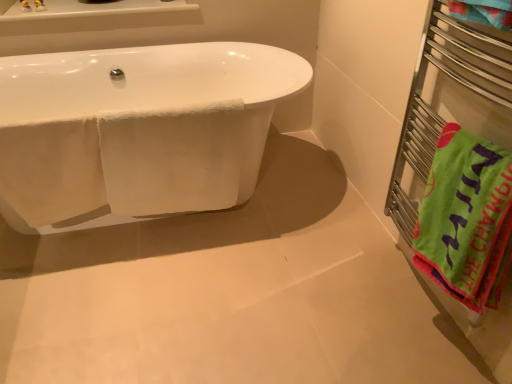
Where is `free space to the left of metal towel rack at right`? free space to the left of metal towel rack at right is located at coordinates (307, 291).